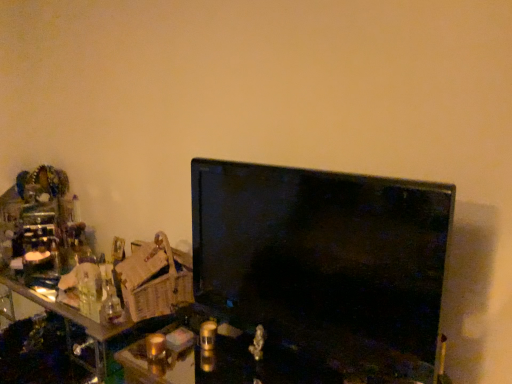
Question: Does matte black monitor at center appear on the right side of black glossy tv at center?

Choices:
 (A) yes
 (B) no

Answer: (B)

Question: From a real-world perspective, is matte black monitor at center physically above black glossy tv at center?

Choices:
 (A) yes
 (B) no

Answer: (B)

Question: Considering the relative sizes of matte black monitor at center and black glossy tv at center in the image provided, is matte black monitor at center wider than black glossy tv at center?

Choices:
 (A) yes
 (B) no

Answer: (A)

Question: Could you tell me if matte black monitor at center is facing black glossy tv at center?

Choices:
 (A) no
 (B) yes

Answer: (A)

Question: Can you confirm if matte black monitor at center is thinner than black glossy tv at center?

Choices:
 (A) no
 (B) yes

Answer: (A)

Question: Is matte black monitor at center at the left side of black glossy tv at center?

Choices:
 (A) yes
 (B) no

Answer: (A)

Question: From a real-world perspective, is black glossy tv at center under matte black monitor at center?

Choices:
 (A) yes
 (B) no

Answer: (B)

Question: Is black glossy tv at center positioned beyond the bounds of matte black monitor at center?

Choices:
 (A) yes
 (B) no

Answer: (A)

Question: From the image's perspective, is black glossy tv at center above matte black monitor at center?

Choices:
 (A) no
 (B) yes

Answer: (B)

Question: Are black glossy tv at center and matte black monitor at center making contact?

Choices:
 (A) no
 (B) yes

Answer: (A)

Question: Considering the relative sizes of black glossy tv at center and matte black monitor at center in the image provided, is black glossy tv at center thinner than matte black monitor at center?

Choices:
 (A) yes
 (B) no

Answer: (A)

Question: Considering the relative sizes of black glossy tv at center and matte black monitor at center in the image provided, is black glossy tv at center bigger than matte black monitor at center?

Choices:
 (A) yes
 (B) no

Answer: (B)

Question: From their relative heights in the image, would you say matte black monitor at center is taller or shorter than black glossy tv at center?

Choices:
 (A) tall
 (B) short

Answer: (B)